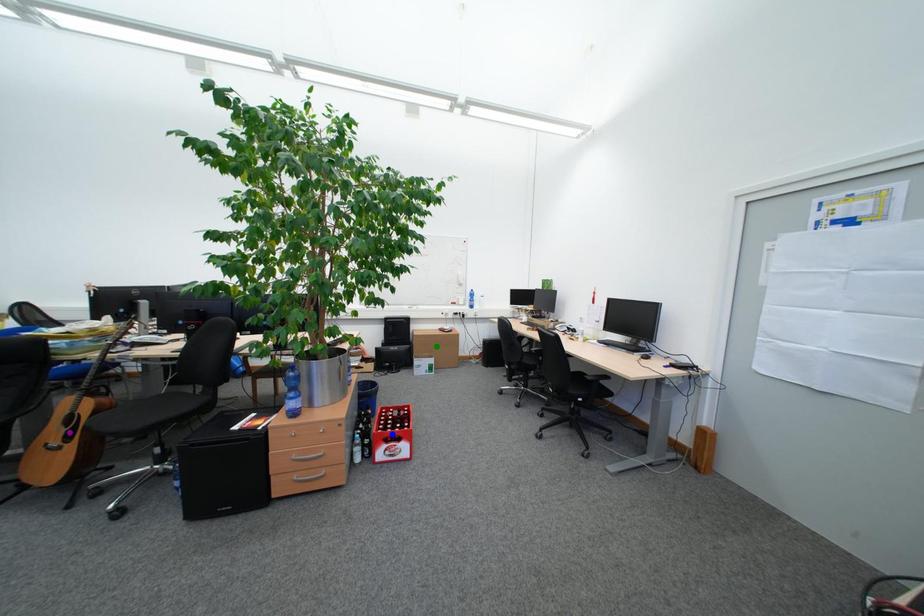
Order these from nearest to farthest:
A) purple point
B) green point
C) blue point

purple point
blue point
green point